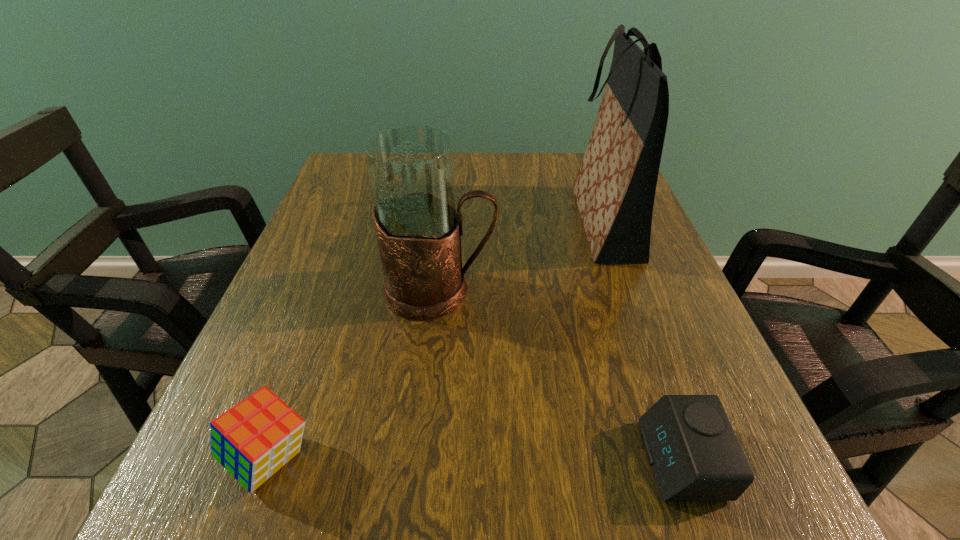
Where is `vacant area that lies between the leftmost object and the pitcher`? The image size is (960, 540). vacant area that lies between the leftmost object and the pitcher is located at coordinates (355, 374).

Locate an element on the screen. Image resolution: width=960 pixels, height=540 pixels. vacant point located between the second object from left to right and the shopping bag is located at coordinates (521, 256).

Find the location of `vacant point located between the third object from right to left and the shopping bag`. vacant point located between the third object from right to left and the shopping bag is located at coordinates (521, 256).

Image resolution: width=960 pixels, height=540 pixels. What are the coordinates of `free space between the shortest object and the shopping bag` in the screenshot? It's located at 642,341.

You are a GUI agent. You are given a task and a screenshot of the screen. Output one action in this format:
    pyautogui.click(x=<x>, y=<y>)
    Task: Click on the free space between the alarm clock and the third tallest object
    
    Given the screenshot: What is the action you would take?
    pyautogui.click(x=476, y=459)

Find the location of `unoccupied position between the shopping bag and the shortest object`. unoccupied position between the shopping bag and the shortest object is located at coordinates (642, 341).

The height and width of the screenshot is (540, 960). I want to click on the third closest object to the pitcher, so [x=694, y=454].

Identify which object is located as the second nearest to the shopping bag. Please provide its 2D coordinates. Your answer should be formatted as a tuple, i.e. [(x, y)], where the tuple contains the x and y coordinates of a point satisfying the conditions above.

[(694, 454)]